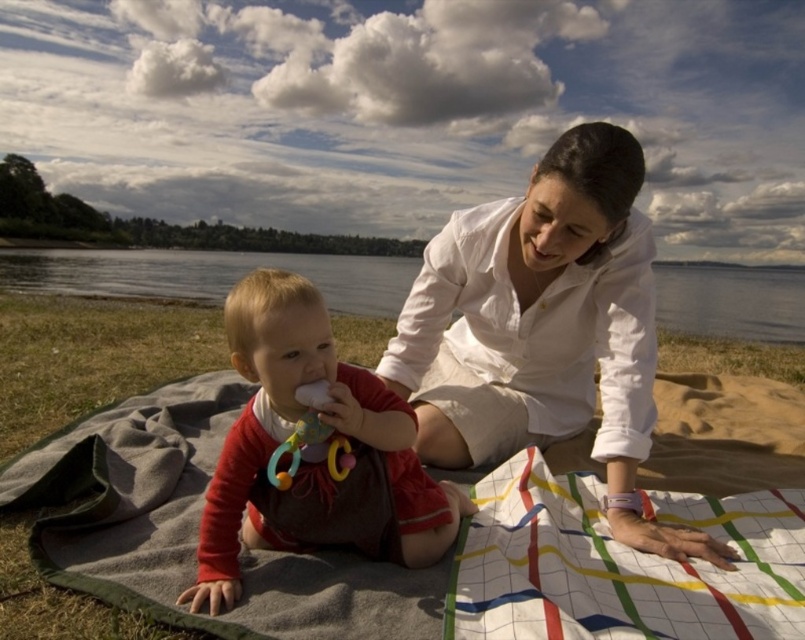
This screenshot has height=640, width=805. What do you see at coordinates (312, 451) in the screenshot?
I see `red cotton onesie at center` at bounding box center [312, 451].

Is red cotton onesie at center to the left of rubber teething ring at center from the viewer's perspective?

Indeed, red cotton onesie at center is positioned on the left side of rubber teething ring at center.

Does point (440, 484) come farther from viewer compared to point (345, 474)?

Yes, point (440, 484) is farther from viewer.

The image size is (805, 640). I want to click on red cotton onesie at center, so click(312, 451).

Can you confirm if white woven blanket at center is bigger than red cotton onesie at center?

Yes, white woven blanket at center is bigger than red cotton onesie at center.

Between point (213, 380) and point (229, 342), which one is positioned behind?

The point (213, 380) is behind.

This screenshot has width=805, height=640. I want to click on white woven blanket at center, so 193,528.

Can you confirm if white woven blanket at center is thinner than clear water at center?

Yes, white woven blanket at center is thinner than clear water at center.

What do you see at coordinates (193, 528) in the screenshot? I see `white woven blanket at center` at bounding box center [193, 528].

Locate an element on the screen. The height and width of the screenshot is (640, 805). white woven blanket at center is located at coordinates (193, 528).